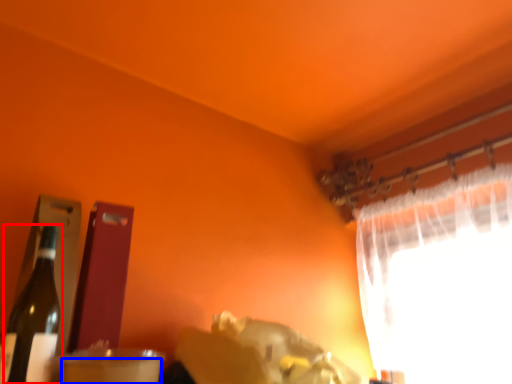
Question: Among these objects, which one is nearest to the camera, bottle (highlighted by a red box) or drinking straw (highlighted by a blue box)?

Choices:
 (A) bottle
 (B) drinking straw

Answer: (B)